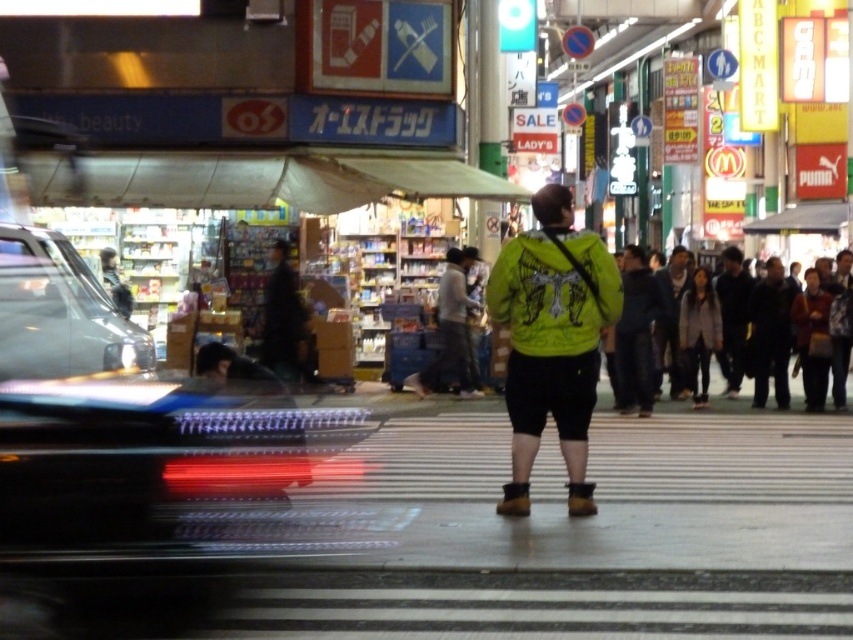
What are the coordinates of `neon green jacket at center` in the screenshot? It's located at (552, 339).

Is point (514, 468) farther from viewer compared to point (741, 273)?

No, (514, 468) is closer to viewer.

Is point (527, 259) positioned before point (724, 376)?

Yes.

What are the coordinates of `neon green jacket at center` in the screenshot? It's located at (552, 339).

Is shiny black car at left smaller than dark gray fabric crowd at right?

Incorrect, shiny black car at left is not smaller in size than dark gray fabric crowd at right.

Does shiny black car at left have a greater height compared to dark gray fabric crowd at right?

No.

You are a GUI agent. You are given a task and a screenshot of the screen. Output one action in this format:
    pyautogui.click(x=<x>, y=<y>)
    Task: Click on the shiny black car at left
    
    Given the screenshot: What is the action you would take?
    pyautogui.click(x=59, y=312)

What are the coordinates of `shiny black car at left` in the screenshot? It's located at (59, 312).

Can you confirm if dark gray fabric crowd at right is thinner than dark gray fabric jacket at right?

No, dark gray fabric crowd at right is not thinner than dark gray fabric jacket at right.

Where is `dark gray fabric crowd at right`? dark gray fabric crowd at right is located at coordinates (675, 320).

Is point (740, 333) positioned in front of point (733, 340)?

Yes, point (740, 333) is in front of point (733, 340).

At what (x,y) coordinates should I click in order to perform the action: click on dark gray fabric crowd at right. Please return your answer as a coordinate pair (x, y). This screenshot has height=640, width=853. Looking at the image, I should click on (675, 320).